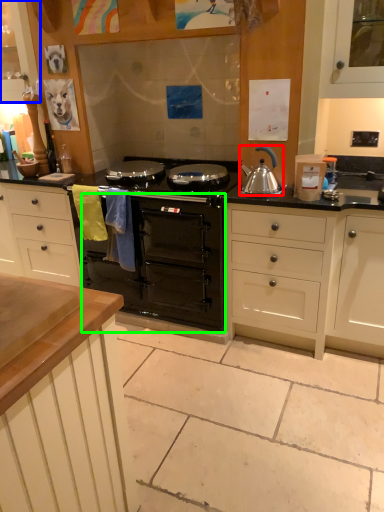
Question: Which object is the farthest from kitchen appliance (highlighted by a red box)? Choose among these: cabinetry (highlighted by a blue box) or oven (highlighted by a green box).

Choices:
 (A) cabinetry
 (B) oven

Answer: (A)